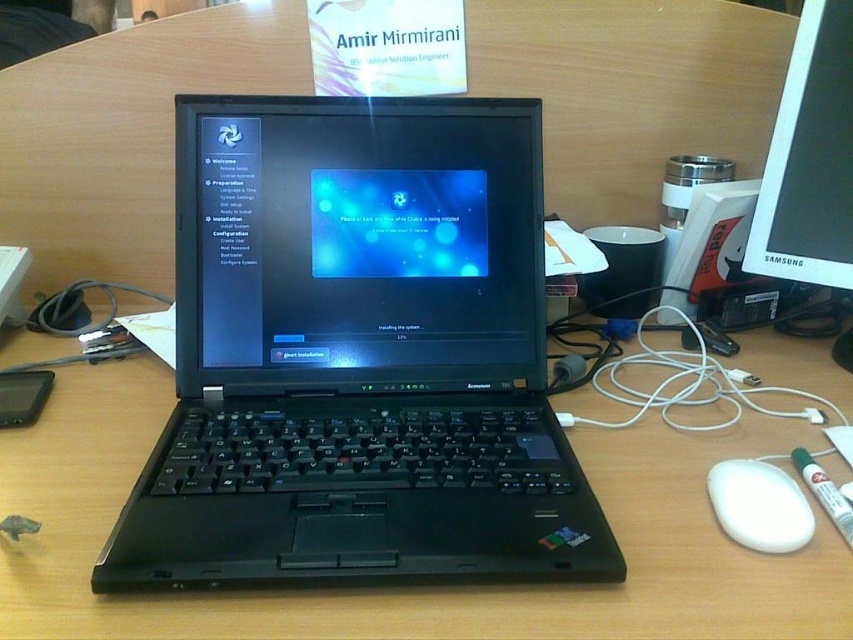
You are organizing a desk space and need to determine if the black matte laptop at center can fit entirely on the wooden table at center. Based on their sizes, can the laptop fit on the table?

The black matte laptop at center has a smaller size compared to wooden table at center, so yes, the laptop can fit entirely on the table.

You are setting up a new workspace and need to place a 2cm thick notebook between the black matte laptop at center and the wooden table at center. Will there be enough space for the notebook?

The black matte laptop at center is thinner than the wooden table at center, but the description does not provide exact measurements of their thickness or the available space between them. Without knowing the specific dimensions, it is impossible to determine if the 2cm thick notebook will fit between them.

You are setting up a new workspace and need to place a black glossy laptop at center on top of the wooden table at center. Is there enough space for the laptop to be placed directly on the table?

The wooden table at center is located below the black glossy laptop at center, which means the laptop is already placed on the table. Therefore, there is sufficient space for the laptop to be placed directly on the wooden table at center.